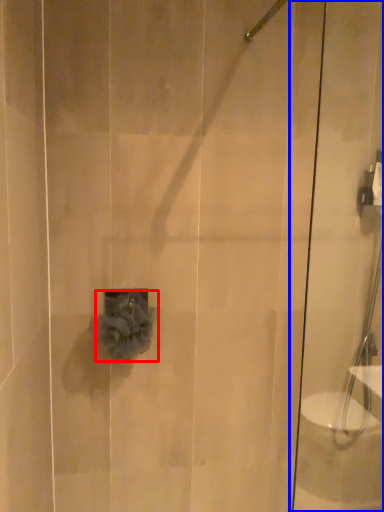
Question: Which object is closer to the camera taking this photo, flower (highlighted by a red box) or shower door (highlighted by a blue box)?

Choices:
 (A) flower
 (B) shower door

Answer: (B)